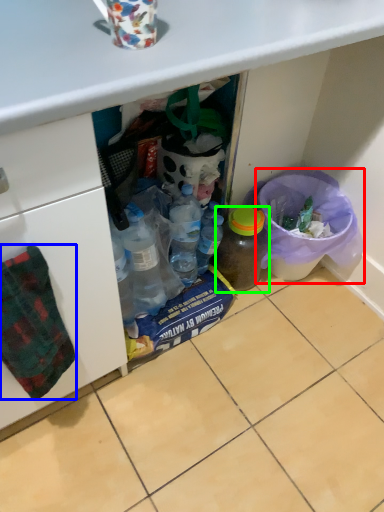
Question: Which object is the farthest from recycling bin (highlighted by a red box)? Choose among these: blanket (highlighted by a blue box) or bottle (highlighted by a green box).

Choices:
 (A) blanket
 (B) bottle

Answer: (A)